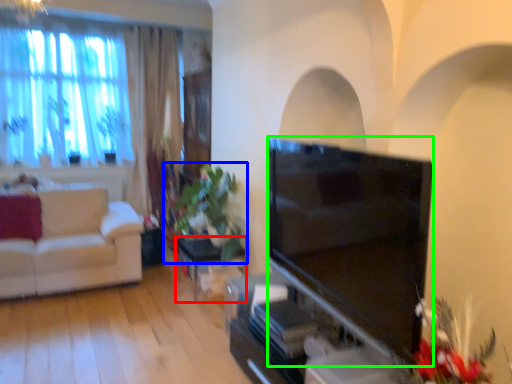
Question: Estimate the real-world distances between objects in this image. Which object is farther from table (highlighted by a red box), houseplant (highlighted by a blue box) or television (highlighted by a green box)?

Choices:
 (A) houseplant
 (B) television

Answer: (B)